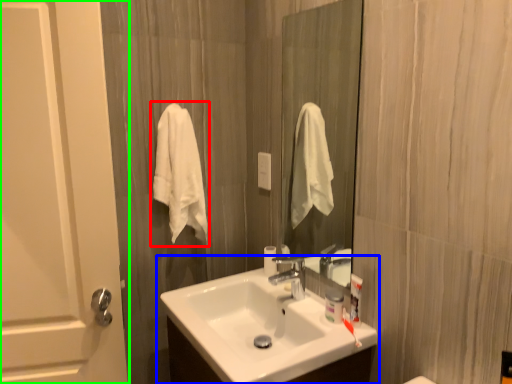
Question: Considering the real-world distances, which object is closest to bath towel (highlighted by a red box)? sink (highlighted by a blue box) or door (highlighted by a green box).

Choices:
 (A) sink
 (B) door

Answer: (B)